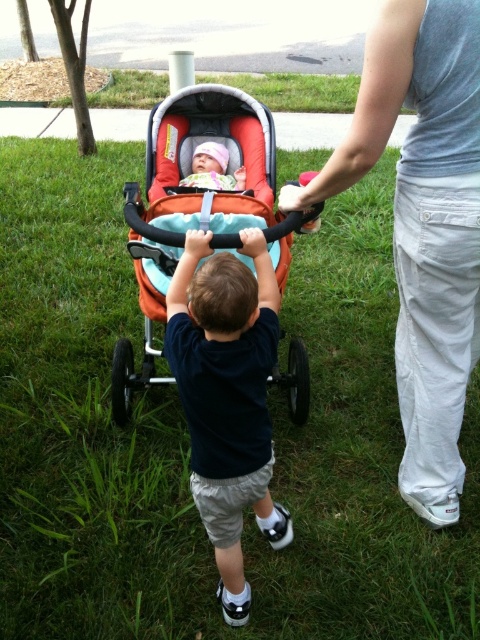
Question: Among these points, which one is farthest from the camera?

Choices:
 (A) (218, 182)
 (B) (126, 216)
 (C) (479, 292)

Answer: (A)

Question: Is dark blue shirt at center positioned at the back of orange fabric baby carriage at center?

Choices:
 (A) no
 (B) yes

Answer: (A)

Question: Is the position of gray cotton shirt at upper right more distant than that of matte pink hat at center?

Choices:
 (A) no
 (B) yes

Answer: (A)

Question: Which point appears farthest from the camera in this image?

Choices:
 (A) pyautogui.click(x=189, y=100)
 (B) pyautogui.click(x=216, y=307)
 (C) pyautogui.click(x=446, y=72)
 (D) pyautogui.click(x=217, y=148)

Answer: (A)

Question: Does gray cotton shirt at upper right appear on the right side of dark blue shirt at center?

Choices:
 (A) yes
 (B) no

Answer: (A)

Question: Which object appears farthest from the camera in this image?

Choices:
 (A) matte pink hat at center
 (B) gray cotton shirt at upper right

Answer: (A)